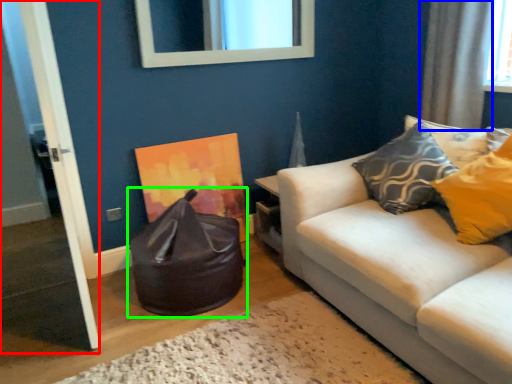
Question: Estimate the real-world distances between objects in this image. Which object is closer to door (highlighted by a red box), curtain (highlighted by a blue box) or bean bag chair (highlighted by a green box)?

Choices:
 (A) curtain
 (B) bean bag chair

Answer: (B)